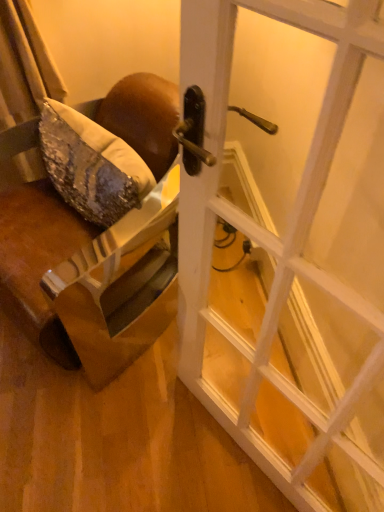
Question: From a real-world perspective, is white glossy door at center over brown leather chair at left?

Choices:
 (A) no
 (B) yes

Answer: (B)

Question: Considering the relative sizes of white glossy door at center and brown leather chair at left in the image provided, is white glossy door at center smaller than brown leather chair at left?

Choices:
 (A) yes
 (B) no

Answer: (A)

Question: Does white glossy door at center have a lesser height compared to brown leather chair at left?

Choices:
 (A) yes
 (B) no

Answer: (B)

Question: Is white glossy door at center further to camera compared to brown leather chair at left?

Choices:
 (A) no
 (B) yes

Answer: (A)

Question: Does white glossy door at center lie in front of brown leather chair at left?

Choices:
 (A) yes
 (B) no

Answer: (A)

Question: From a real-world perspective, is white glossy door at center below brown leather chair at left?

Choices:
 (A) yes
 (B) no

Answer: (B)

Question: Does brown leather chair at left turn towards white glossy door at center?

Choices:
 (A) no
 (B) yes

Answer: (A)

Question: Is brown leather chair at left to the left of white glossy door at center from the viewer's perspective?

Choices:
 (A) yes
 (B) no

Answer: (A)

Question: From a real-world perspective, is brown leather chair at left located beneath white glossy door at center?

Choices:
 (A) no
 (B) yes

Answer: (B)

Question: Does brown leather chair at left have a lesser height compared to white glossy door at center?

Choices:
 (A) yes
 (B) no

Answer: (A)

Question: Is brown leather chair at left next to white glossy door at center?

Choices:
 (A) yes
 (B) no

Answer: (B)

Question: Is brown leather chair at left outside white glossy door at center?

Choices:
 (A) no
 (B) yes

Answer: (B)

Question: Based on their positions, is brown leather chair at left located to the left or right of white glossy door at center?

Choices:
 (A) right
 (B) left

Answer: (B)